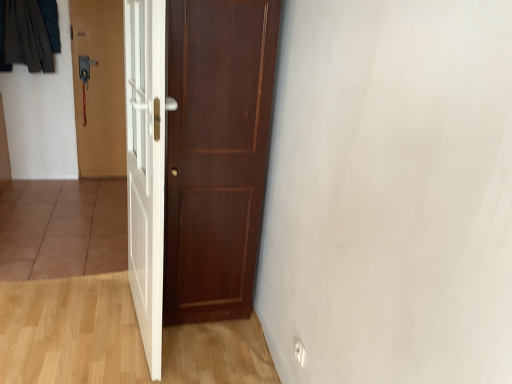
Question: Is matte wood door at center, placed as the 1th door when sorted from right to left, taller than dark gray fabric at upper left?

Choices:
 (A) yes
 (B) no

Answer: (A)

Question: Can you confirm if matte wood door at center, which is the 3th door in left-to-right order, is shorter than dark gray fabric at upper left?

Choices:
 (A) no
 (B) yes

Answer: (A)

Question: From the image's perspective, is matte wood door at center, marked as the second door in a front-to-back arrangement, located above dark gray fabric at upper left?

Choices:
 (A) yes
 (B) no

Answer: (B)

Question: Can you confirm if matte wood door at center, placed as the 1th door when sorted from right to left, is bigger than dark gray fabric at upper left?

Choices:
 (A) yes
 (B) no

Answer: (A)

Question: Is matte wood door at center, which appears as the second door when viewed from the back, oriented towards dark gray fabric at upper left?

Choices:
 (A) yes
 (B) no

Answer: (B)

Question: Is matte wood door at center, which is the 3th door in left-to-right order, inside the boundaries of white glossy door at center, which is counted as the 2th door, starting from the left, or outside?

Choices:
 (A) inside
 (B) outside

Answer: (B)

Question: Is point (232, 258) positioned closer to the camera than point (137, 34)?

Choices:
 (A) closer
 (B) farther

Answer: (B)

Question: Considering their positions, is matte wood door at center, which appears as the second door when viewed from the back, located in front of or behind white glossy door at center, which is counted as the 2th door, starting from the left?

Choices:
 (A) front
 (B) behind

Answer: (B)

Question: From a real-world perspective, is matte wood door at center, placed as the 1th door when sorted from right to left, above or below white glossy door at center, positioned as the second door in right-to-left order?

Choices:
 (A) below
 (B) above

Answer: (B)

Question: Is wooden door at left, arranged as the first door when viewed from the back, situated inside dark gray fabric at upper left or outside?

Choices:
 (A) outside
 (B) inside

Answer: (A)

Question: In terms of height, does wooden door at left, the third door positioned from the right, look taller or shorter compared to dark gray fabric at upper left?

Choices:
 (A) short
 (B) tall

Answer: (B)

Question: Looking at their shapes, would you say wooden door at left, the third door positioned from the right, is wider or thinner than dark gray fabric at upper left?

Choices:
 (A) wide
 (B) thin

Answer: (B)

Question: Looking at the image, does wooden door at left, the first door viewed from the left, seem bigger or smaller compared to dark gray fabric at upper left?

Choices:
 (A) small
 (B) big

Answer: (B)

Question: Is white glossy door at center, which is counted as the 2th door, starting from the left, in front of or behind matte wood door at center, placed as the 1th door when sorted from right to left, in the image?

Choices:
 (A) front
 (B) behind

Answer: (A)

Question: Considering the positions of white glossy door at center, which is counted as the 2th door, starting from the left, and matte wood door at center, which appears as the second door when viewed from the back, in the image, is white glossy door at center, which is counted as the 2th door, starting from the left, taller or shorter than matte wood door at center, which appears as the second door when viewed from the back,?

Choices:
 (A) tall
 (B) short

Answer: (B)